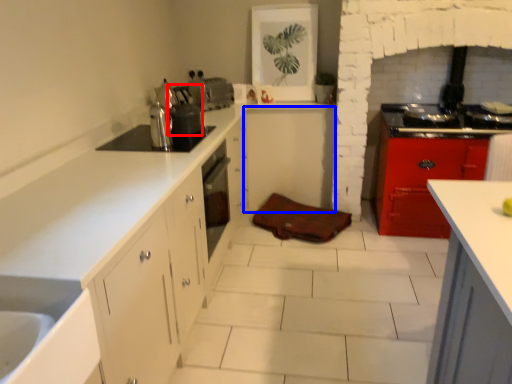
Question: Which of the following is the closest to the observer, appliance (highlighted by a red box) or cabinetry (highlighted by a blue box)?

Choices:
 (A) appliance
 (B) cabinetry

Answer: (A)